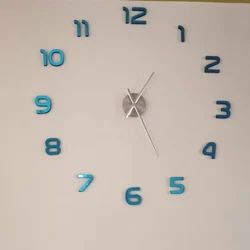
Find the location of `yellow wall behind clock`. yellow wall behind clock is located at coordinates (241, 0).